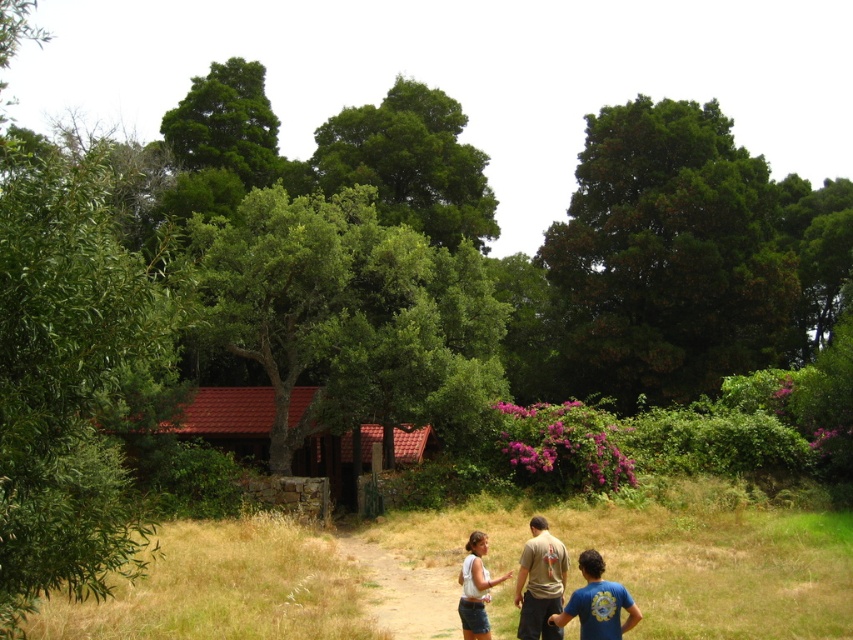
Question: Among these points, which one is farthest from the camera?

Choices:
 (A) (584, 561)
 (B) (672, 276)
 (C) (613, 608)

Answer: (B)

Question: Which object is positioned farthest from the light brown cotton shirt at center?

Choices:
 (A) blue cotton shirt at lower right
 (B) denim shorts at lower center
 (C) white cotton shirt at center

Answer: (A)

Question: Is green leafy tree at upper right to the left of light brown cotton shirt at center from the viewer's perspective?

Choices:
 (A) no
 (B) yes

Answer: (A)

Question: Can you confirm if green leafy tree at upper right is positioned above white cotton shirt at center?

Choices:
 (A) no
 (B) yes

Answer: (B)

Question: Does blue cotton shirt at lower right have a larger size compared to denim shorts at lower center?

Choices:
 (A) yes
 (B) no

Answer: (A)

Question: Among these objects, which one is nearest to the camera?

Choices:
 (A) green leafy tree at left
 (B) blue cotton shirt at lower right

Answer: (A)